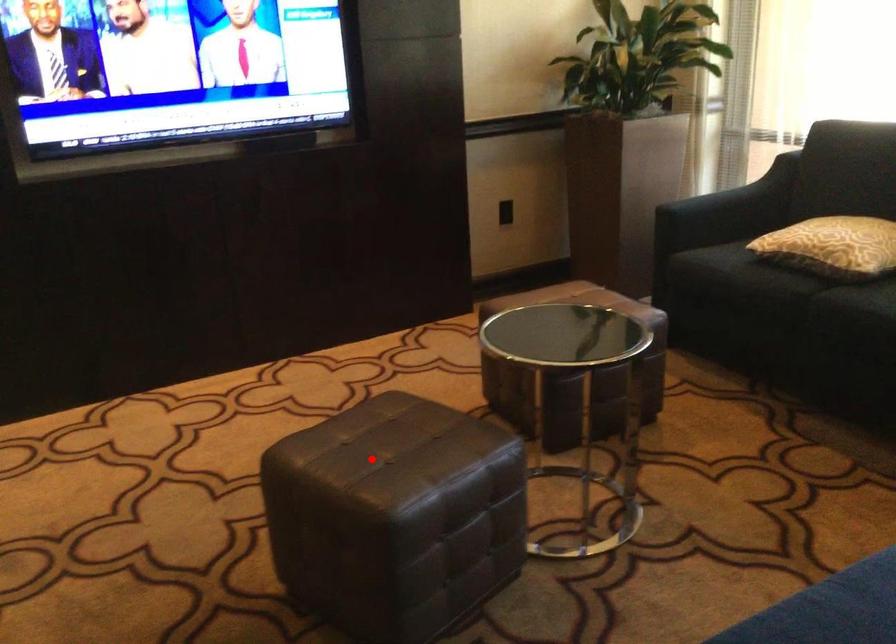
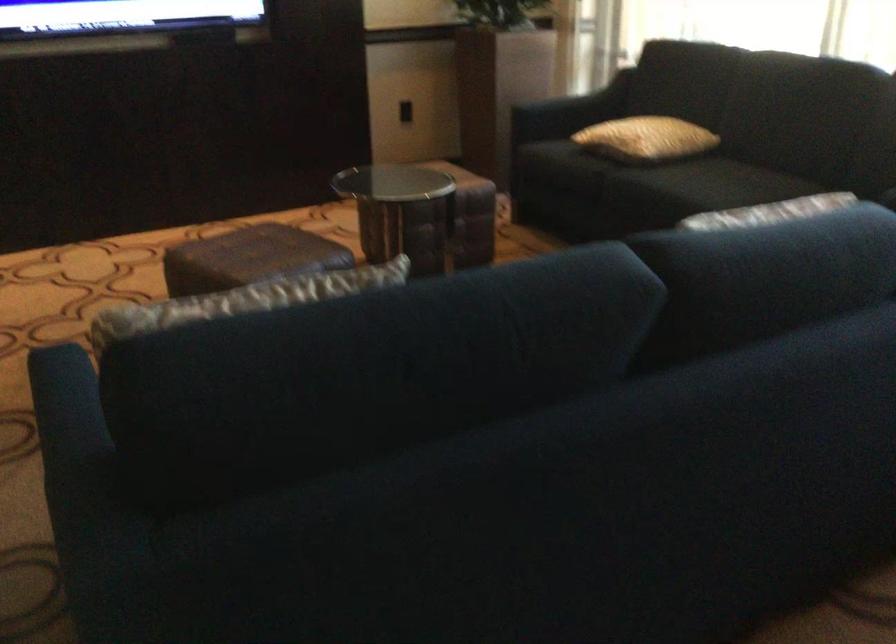
Question: I am providing you with two images of the same scene from different viewpoints. In image1, a red point is highlighted. Considering the same 3D point in image2, which of the following is correct?

Choices:
 (A) It is closer
 (B) It is farther

Answer: (B)